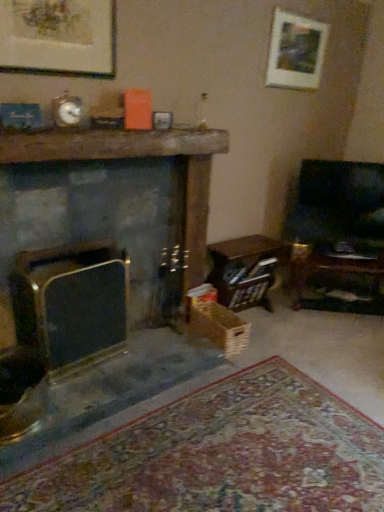
At what (x,y) coordinates should I click in order to perform the action: click on vacant space in front of matte black fireplace at left, which is the first fireplace from left to right. Please return your answer as a coordinate pair (x, y). The image size is (384, 512). Looking at the image, I should click on (88, 383).